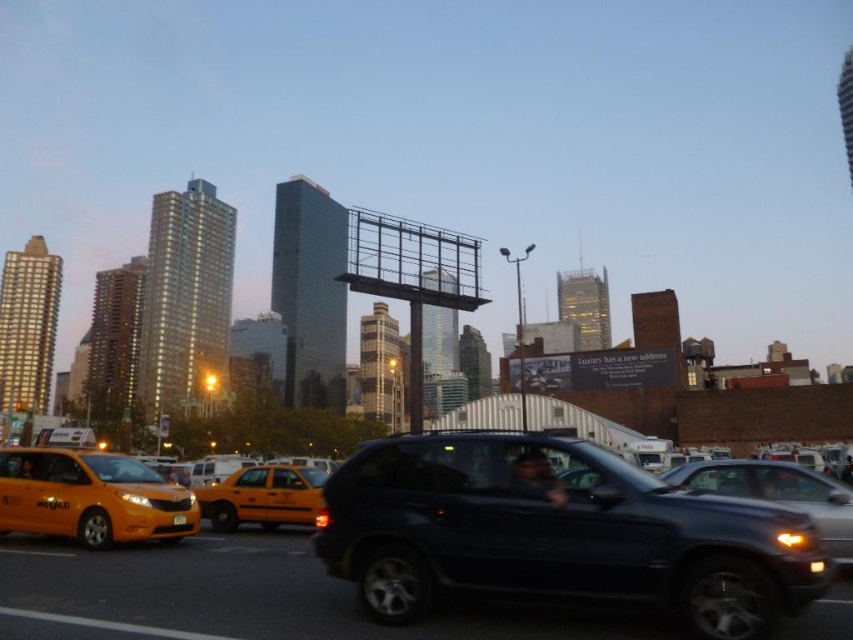
Does satin black suv at center have a lesser height compared to yellow plastic license plate at center?

No, satin black suv at center is not shorter than yellow plastic license plate at center.

Between point (828, 513) and point (178, 515), which one is positioned in front?

Point (828, 513) is more forward.

The width and height of the screenshot is (853, 640). What do you see at coordinates (778, 492) in the screenshot?
I see `satin black suv at center` at bounding box center [778, 492].

Where is `satin black suv at center`? satin black suv at center is located at coordinates (778, 492).

Is point (347, 524) closer to camera compared to point (815, 474)?

Yes, point (347, 524) is in front of point (815, 474).

In the scene shown: Can you confirm if shiny black suv at center is positioned above satin black suv at center?

Indeed, shiny black suv at center is positioned over satin black suv at center.

Between point (584, 600) and point (821, 499), which one is positioned in front?

Point (584, 600) is more forward.

Locate an element on the screen. shiny black suv at center is located at coordinates (558, 532).

Does shiny black suv at center appear on the left side of yellow matte taxi at left?

Incorrect, shiny black suv at center is not on the left side of yellow matte taxi at left.

Can you confirm if shiny black suv at center is positioned above yellow matte taxi at left?

Yes.

Locate an element on the screen. The image size is (853, 640). shiny black suv at center is located at coordinates (558, 532).

Where is `shiny black suv at center`? The width and height of the screenshot is (853, 640). shiny black suv at center is located at coordinates (558, 532).